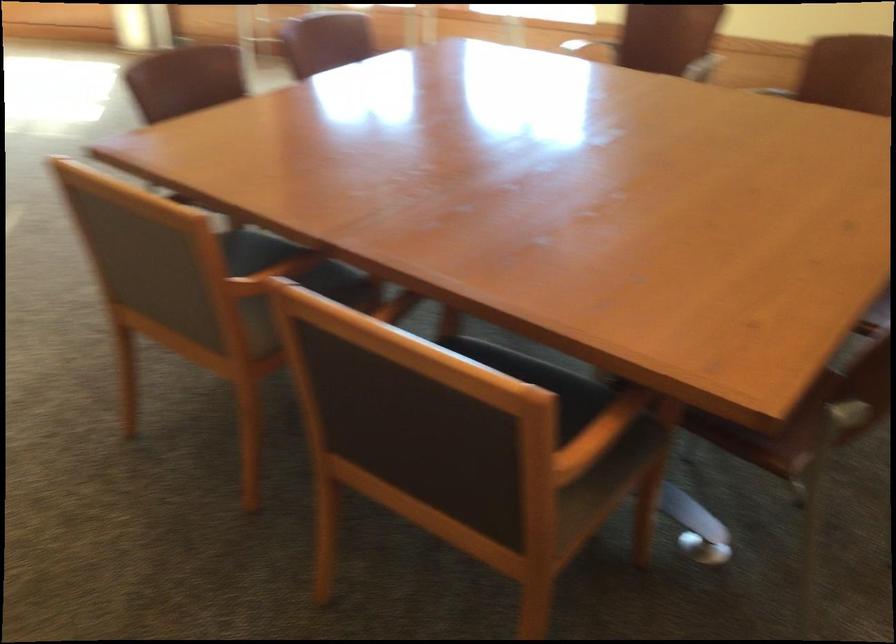
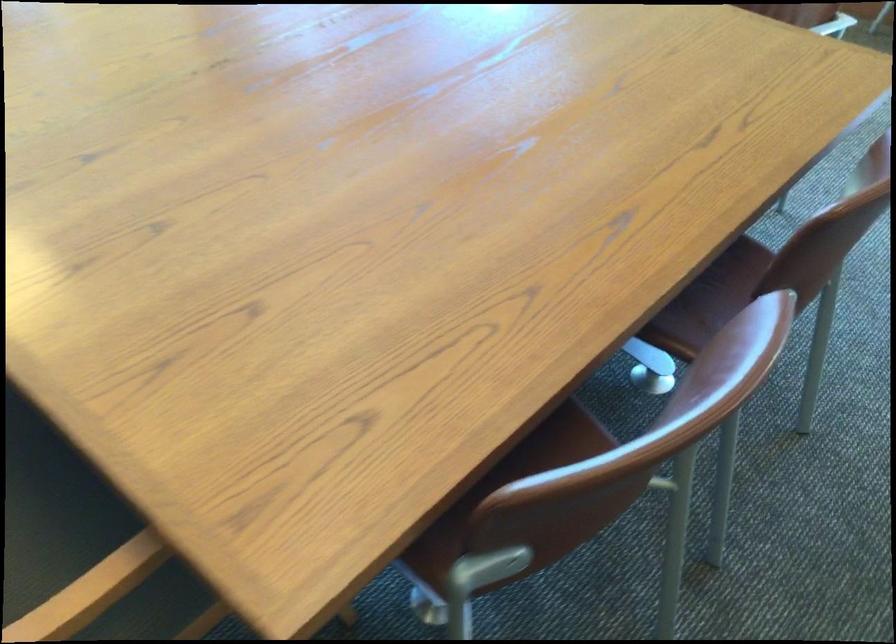
What movement of the cameraman would produce the second image?

The cameraman moved toward right, forward.